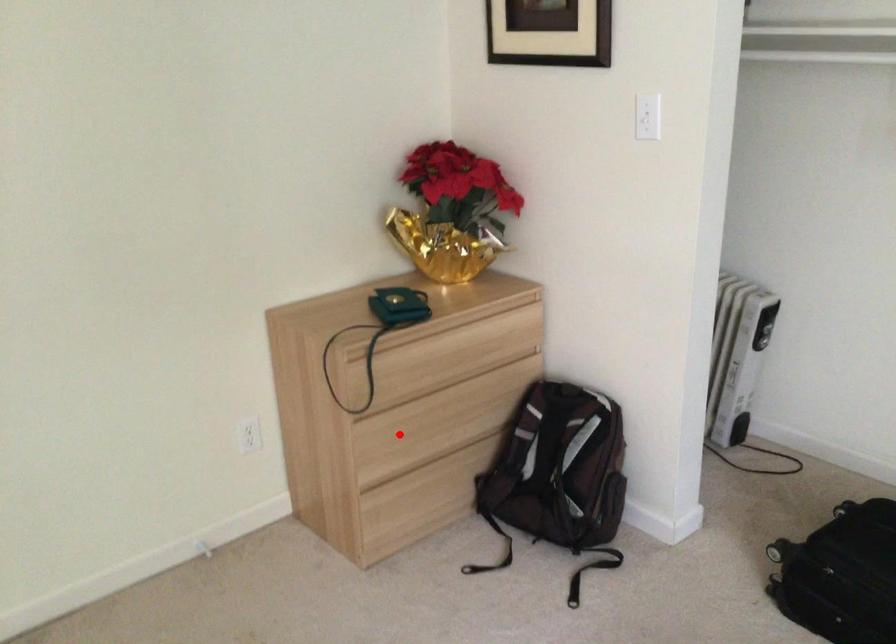
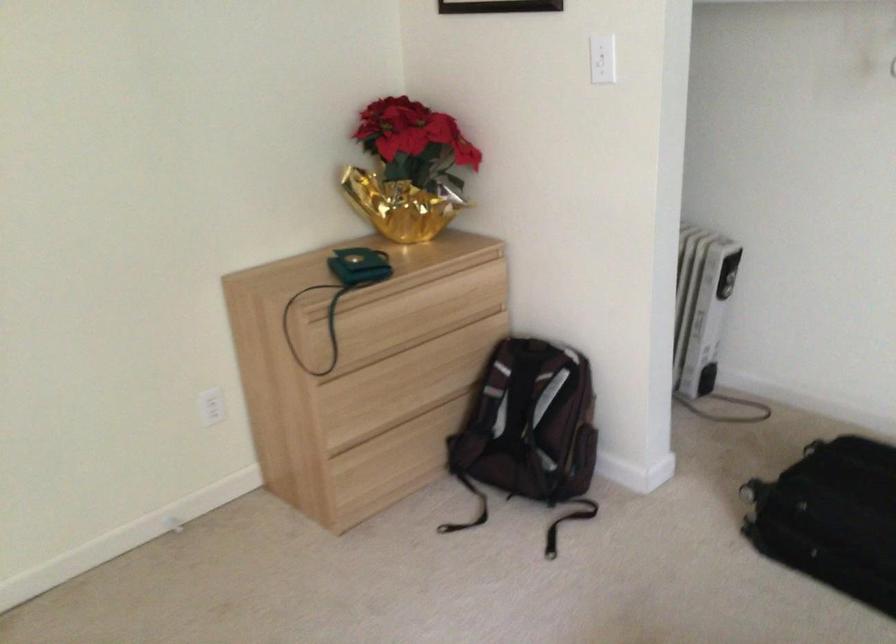
Locate, in the second image, the point that corresponds to the highlighted location in the first image.

(366, 397)